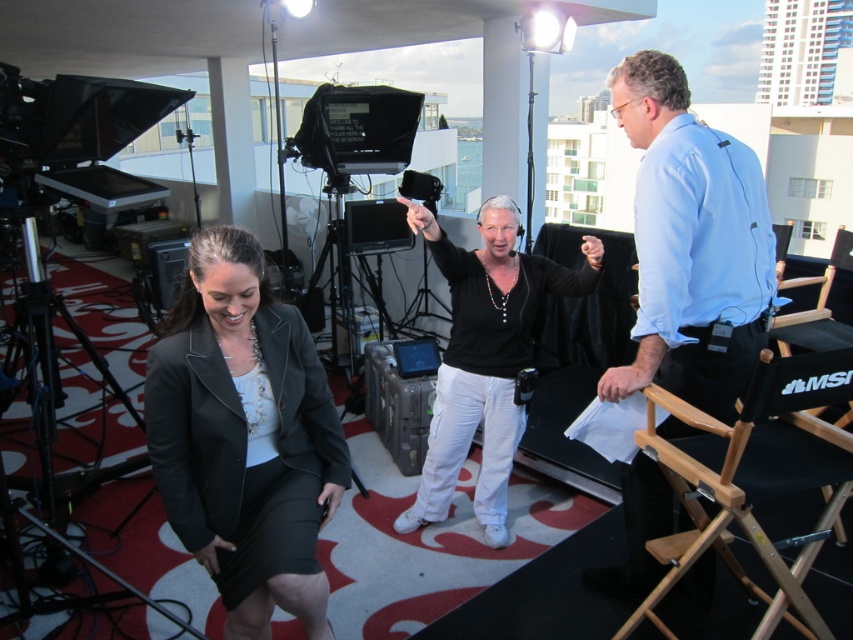
You are a costume designer reviewing the live broadcast setup. You notice two items labeled matte black blazer at center and black matte shirt at center. Which one is positioned to the left?

The matte black blazer at center is positioned to the left of the black matte shirt at center.